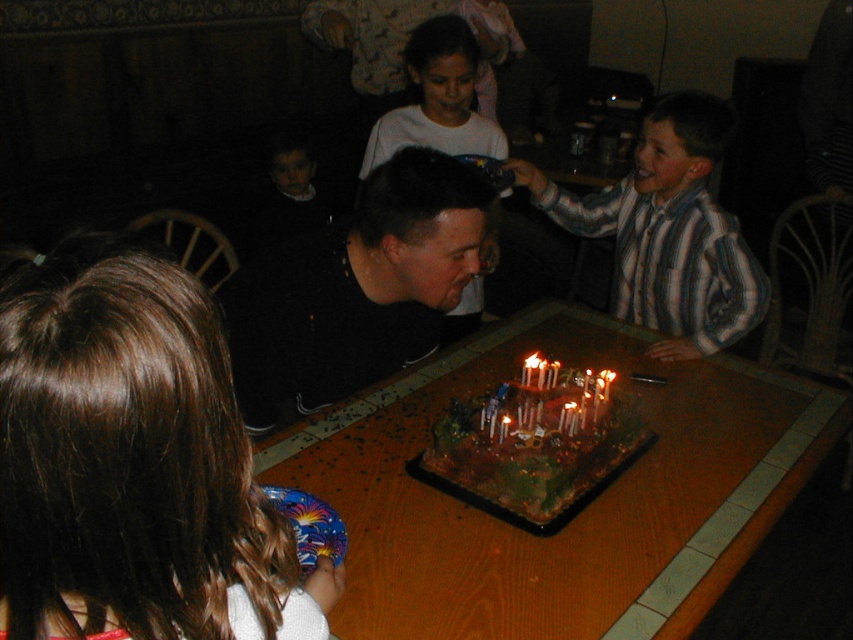
You are standing in front of the birthday cake and want to place a candle at each of the two points labeled point (x=239, y=324) and point (x=498, y=125). Which point should you place the candle closer to the front edge of the cake?

Point (x=239, y=324) is closer to the viewer than point (x=498, y=125), so you should place the candle closer to the front edge of the cake at point (x=239, y=324).

You are a photographer at the birthday celebration. You need to capture a group photo where everyone fits in the frame. The camera you are using has a maximum width capacity of 1.2 meters. The black matte shirt at center and white matte shirt at center are the two widest individuals in the scene. Can both individuals fit side by side within the camera frame?

The black matte shirt at center is wider than the white matte shirt at center. Since the black matte shirt at center is the wider individual, and the camera can only accommodate up to 1.2 meters, we need to know their combined width. However, the description only states that the black is wider, not the exact measurements. Without specific widths, we can assume that if both are within the 1.2m limit when combined, they might fit. But since the exact widths aren

You are at a birthday party and see the white matte shirt at center and the white wax candles at center. Which object is closer to the top of the image?

The white matte shirt at center is located above the white wax candles at center, so it is closer to the top of the image.